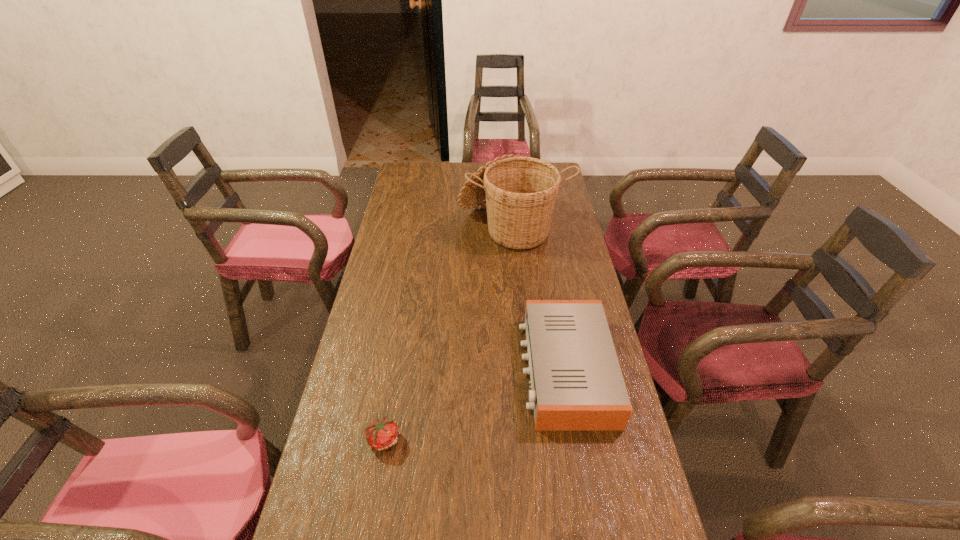
Locate an element on the screen. The width and height of the screenshot is (960, 540). basket is located at coordinates (520, 193).

At what (x,y) coordinates should I click in order to perform the action: click on the tallest object. Please return your answer as a coordinate pair (x, y). This screenshot has height=540, width=960. Looking at the image, I should click on (520, 193).

The height and width of the screenshot is (540, 960). I want to click on radio receiver, so click(576, 381).

Locate an element on the screen. The height and width of the screenshot is (540, 960). tomato is located at coordinates (381, 434).

Identify the location of the leftmost object. (381, 434).

Locate an element on the screen. free space located on the left of the tallest object is located at coordinates (420, 225).

At what (x,y) coordinates should I click in order to perform the action: click on free space located on the control panel of the second tallest object. Please return your answer as a coordinate pair (x, y). This screenshot has width=960, height=540. Looking at the image, I should click on (403, 369).

Find the location of a particular element. vacant area situated 0.110m on the control panel of the second tallest object is located at coordinates (483, 369).

Locate an element on the screen. vacant area situated on the control panel of the second tallest object is located at coordinates (439, 369).

Image resolution: width=960 pixels, height=540 pixels. I want to click on blank space located on the back of the leftmost object, so click(x=401, y=336).